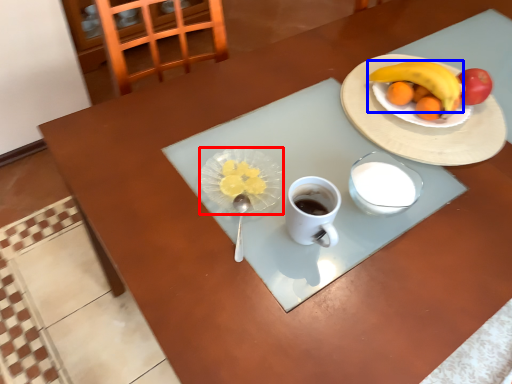
Question: Which object is further to the camera taking this photo, tableware (highlighted by a red box) or banana (highlighted by a blue box)?

Choices:
 (A) tableware
 (B) banana

Answer: (B)